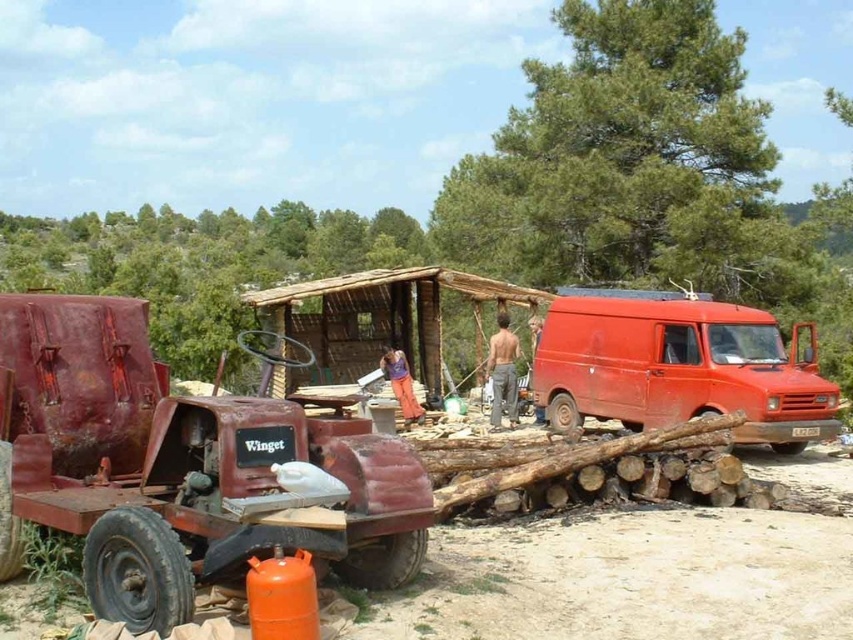
Question: Which of the following is the closest to the observer?

Choices:
 (A) matte red van at right
 (B) skinny man at center
 (C) rusty metal trailer truck at left

Answer: (C)

Question: Which of the following is the farthest from the observer?

Choices:
 (A) rusty metal trailer truck at left
 (B) skinny man at center

Answer: (B)

Question: Can you confirm if rusty metal trailer truck at left is positioned to the right of skinny man at center?

Choices:
 (A) no
 (B) yes

Answer: (A)

Question: Does rusty metal trailer truck at left come behind skinny man at center?

Choices:
 (A) no
 (B) yes

Answer: (A)

Question: Which point is closer to the camera?

Choices:
 (A) matte red van at right
 (B) rusty metal trailer truck at left
 (C) skinny man at center

Answer: (B)

Question: Is rusty metal trailer truck at left to the right of skinny man at center from the viewer's perspective?

Choices:
 (A) yes
 (B) no

Answer: (B)